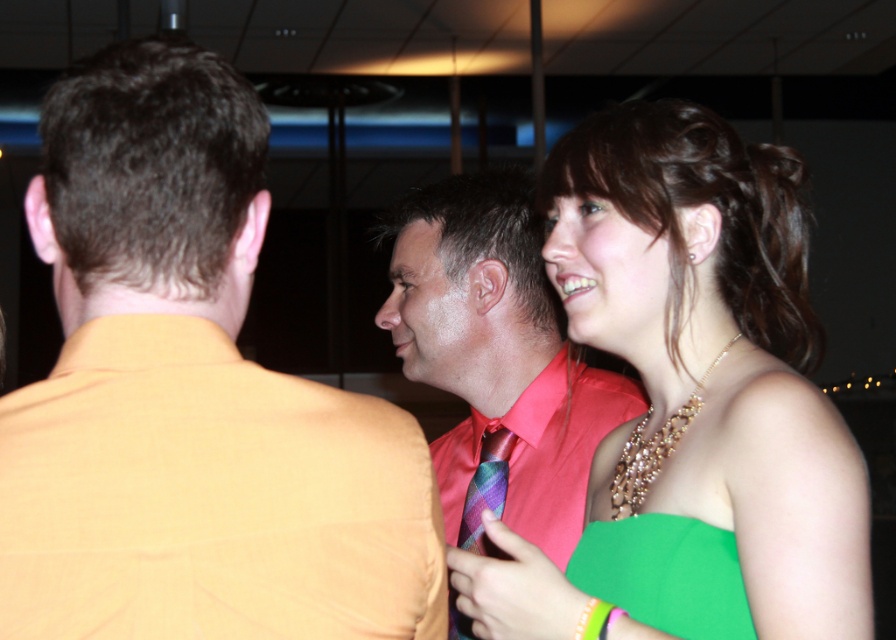
You are a photographer at the event and want to capture a photo of both the green satin dress at center and the green fabric dress at center in the same frame. The camera you are using has a minimum focus distance of 8 inches. Will both dresses be in focus?

The green satin dress at center and the green fabric dress at center are 8.19 inches apart, which is slightly more than the camera minimum focus distance of 8 inches. Therefore, both dresses will be in focus.

Consider the image. You are a photographer at the event and want to capture a photo of both the green satin dress at center and the green fabric dress at center. Since the camera can only focus on one subject at a time, which dress should you focus on first to ensure the taller one is in focus?

The green satin dress at center is taller than the green fabric dress at center, so you should focus on the green satin dress at center first to ensure it is in focus.

You are a photographer adjusting camera settings for a group photo. You notice the orange fabric shirt at left and the multicolored striped tie at center. Which object should you focus on first if you want to ensure the wider subject is in sharp focus?

The orange fabric shirt at left is wider than the multicolored striped tie at center, so you should focus on the orange fabric shirt at left first to ensure the wider subject is in sharp focus.